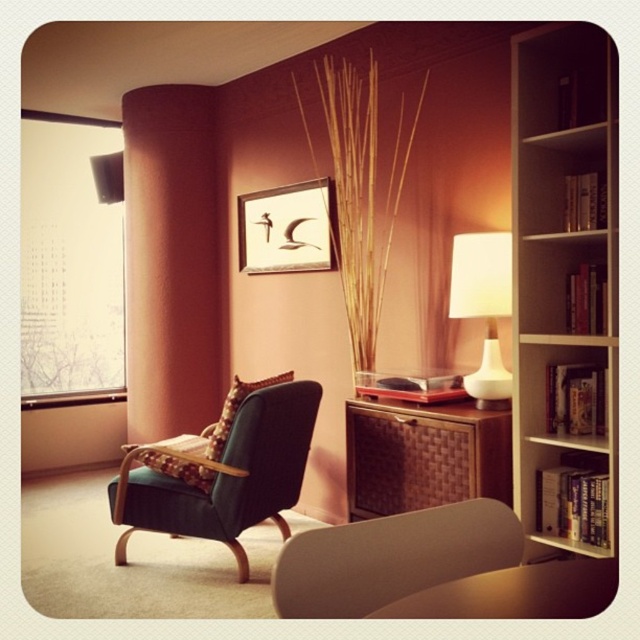
Who is lower down, white wood bookshelf at right or matte wooden picture frame at upper center?

white wood bookshelf at right is below.

Measure the distance between point (557, 435) and camera.

Point (557, 435) is 2.25 meters from camera.

At what (x,y) coordinates should I click in order to perform the action: click on white wood bookshelf at right. Please return your answer as a coordinate pair (x, y). This screenshot has height=640, width=640. Looking at the image, I should click on (561, 253).

Can you confirm if white wood bookshelf at right is shorter than velvet dark green armchair at center?

Incorrect, white wood bookshelf at right's height does not fall short of velvet dark green armchair at center's.

Is point (566, 45) positioned after point (227, 483)?

No, it is not.

Who is more forward, (576, 163) or (125, 538)?

Point (576, 163)

Where is `white wood bookshelf at right`? white wood bookshelf at right is located at coordinates (561, 253).

Is transparent glass window at left closer to camera compared to matte teal armchair at center?

No.

Can you confirm if transparent glass window at left is smaller than matte teal armchair at center?

Incorrect, transparent glass window at left is not smaller in size than matte teal armchair at center.

Is point (22, 368) farther from viewer compared to point (497, 561)?

Yes.

The image size is (640, 640). What are the coordinates of `transparent glass window at left` in the screenshot? It's located at coord(70,257).